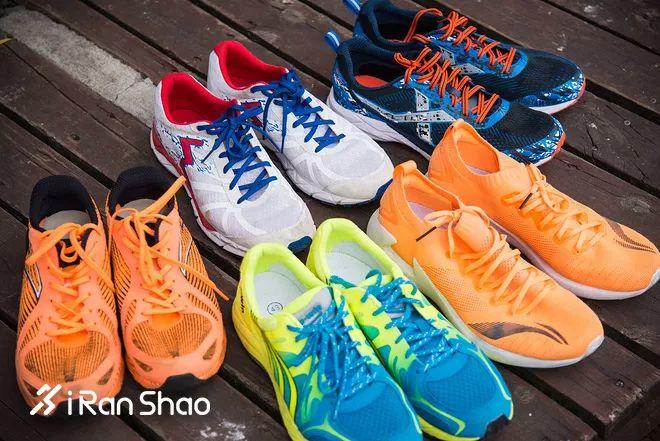
You are a GUI agent. You are given a task and a screenshot of the screen. Output one action in this format:
    pyautogui.click(x=<x>, y=<y>)
    Task: Click on the board
    
    Given the screenshot: What is the action you would take?
    pyautogui.click(x=639, y=25), pyautogui.click(x=616, y=66), pyautogui.click(x=605, y=133), pyautogui.click(x=583, y=183), pyautogui.click(x=635, y=329), pyautogui.click(x=604, y=374), pyautogui.click(x=532, y=419), pyautogui.click(x=240, y=413), pyautogui.click(x=107, y=418)